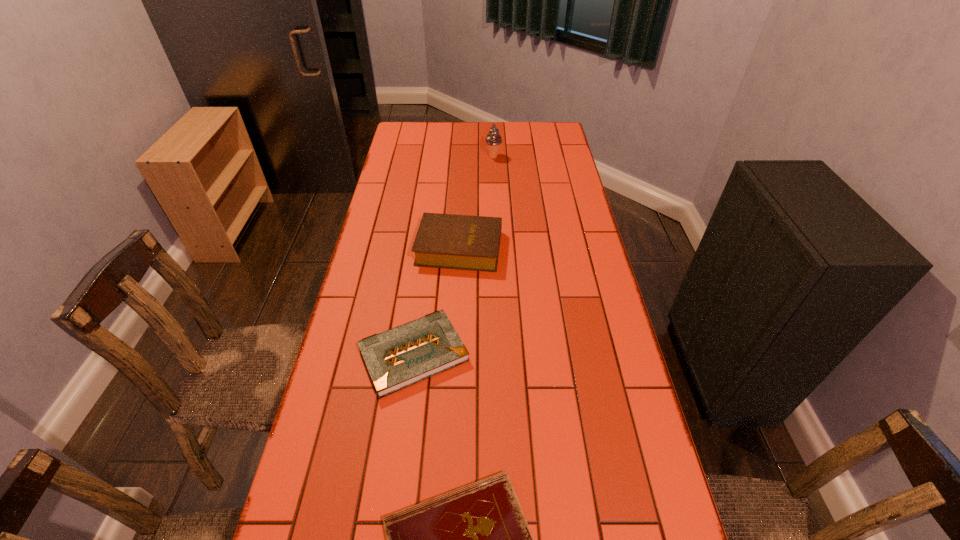
At what (x,y) coordinates should I click in order to perform the action: click on free space at the far edge. Please return your answer as a coordinate pair (x, y). The image size is (960, 540). Looking at the image, I should click on (510, 145).

At what (x,y) coordinates should I click in order to perform the action: click on vacant space at the left edge. Please return your answer as a coordinate pair (x, y). The width and height of the screenshot is (960, 540). Looking at the image, I should click on (398, 156).

Locate an element on the screen. The width and height of the screenshot is (960, 540). free space at the right edge of the desktop is located at coordinates (640, 471).

This screenshot has width=960, height=540. I want to click on vacant space at the far left corner, so click(x=397, y=140).

What are the coordinates of `vacant area at the far right corner` in the screenshot? It's located at (563, 146).

Find the location of a particular element. The width and height of the screenshot is (960, 540). free space between the icecream and the Bible is located at coordinates 476,202.

You are a GUI agent. You are given a task and a screenshot of the screen. Output one action in this format:
    pyautogui.click(x=<x>, y=<y>)
    Task: Click on the free point between the tallest object and the third nearest object
    
    Given the screenshot: What is the action you would take?
    pyautogui.click(x=476, y=202)

This screenshot has height=540, width=960. Identify the location of vacant space that is in between the icecream and the third nearest object. (476, 202).

Where is `vacant area between the tallest object and the second farthest object`? This screenshot has width=960, height=540. vacant area between the tallest object and the second farthest object is located at coordinates (476, 202).

The image size is (960, 540). In order to click on vacant space that's between the farther notebook and the second tallest object in this screenshot , I will do `click(437, 301)`.